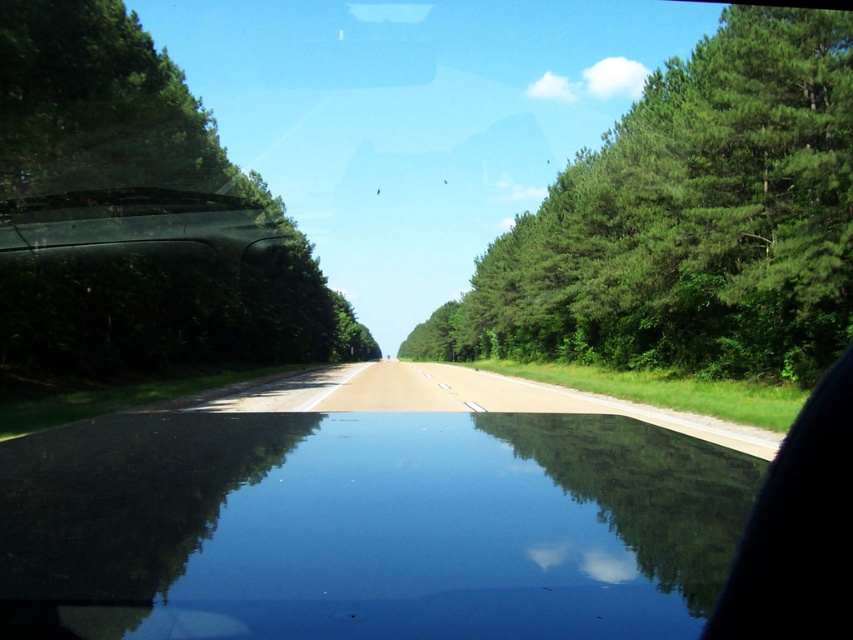
You are driving a car and notice two rows of green leafy trees through your windshield. The green leafy trees at right and the green leafy tree at left frame the road. Which side has trees that are possibly wider?

The green leafy trees at right might be wider than the green leafy tree at left according to the description.

In the scene shown: You are driving a car and looking through the windshield. You notice two green leafy trees in your view. The first is labeled as green leafy trees at right and the second as green leafy tree at left. Which of these trees appears higher in your field of view?

The green leafy trees at right appears higher in your field of view because it is located above the green leafy tree at left according to the description.